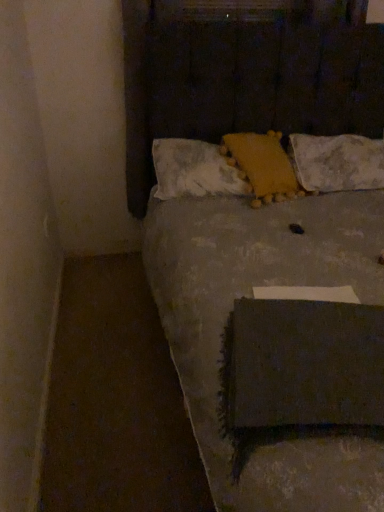
Question: Is textured gray bed at center completely or partially outside of yellow fuzzy pillow at center, which is counted as the 2th pillow, starting from the left?

Choices:
 (A) no
 (B) yes

Answer: (B)

Question: Would you consider textured gray bed at center to be distant from yellow fuzzy pillow at center, which is counted as the 2th pillow, starting from the left?

Choices:
 (A) no
 (B) yes

Answer: (A)

Question: Is textured gray bed at center next to yellow fuzzy pillow at center, which is counted as the 2th pillow, starting from the left, and touching it?

Choices:
 (A) yes
 (B) no

Answer: (B)

Question: Considering the relative positions of textured gray bed at center and yellow fuzzy pillow at center, which is the second pillow in right-to-left order, in the image provided, is textured gray bed at center to the left of yellow fuzzy pillow at center, which is the second pillow in right-to-left order, from the viewer's perspective?

Choices:
 (A) no
 (B) yes

Answer: (A)

Question: Does textured gray bed at center have a lesser height compared to yellow fuzzy pillow at center, which is counted as the 2th pillow, starting from the left?

Choices:
 (A) yes
 (B) no

Answer: (B)

Question: In the image, is textured gray bed at center positioned in front of or behind yellow textured pillow at center, which ranks as the first pillow in left-to-right order?

Choices:
 (A) front
 (B) behind

Answer: (A)

Question: Visually, is textured gray bed at center positioned to the left or to the right of yellow textured pillow at center, which ranks as the first pillow in left-to-right order?

Choices:
 (A) left
 (B) right

Answer: (B)

Question: Is textured gray bed at center wider or thinner than yellow textured pillow at center, the third pillow when ordered from right to left?

Choices:
 (A) thin
 (B) wide

Answer: (B)

Question: From a real-world perspective, relative to yellow textured pillow at center, the third pillow when ordered from right to left, is textured gray bed at center vertically above or below?

Choices:
 (A) below
 (B) above

Answer: (A)

Question: In terms of width, does yellow fuzzy pillow at center, which is counted as the 2th pillow, starting from the left, look wider or thinner when compared to textured gray bed at center?

Choices:
 (A) wide
 (B) thin

Answer: (B)

Question: Is yellow fuzzy pillow at center, which is counted as the 2th pillow, starting from the left, inside or outside of textured gray bed at center?

Choices:
 (A) outside
 (B) inside

Answer: (B)

Question: From a real-world perspective, is yellow fuzzy pillow at center, which is the second pillow in right-to-left order, above or below textured gray bed at center?

Choices:
 (A) below
 (B) above

Answer: (B)

Question: In the image, is yellow fuzzy pillow at center, which is the second pillow in right-to-left order, positioned in front of or behind textured gray bed at center?

Choices:
 (A) front
 (B) behind

Answer: (B)

Question: Visually, is white textured pillow at upper center, which is counted as the 1th pillow, starting from the right, positioned to the left or to the right of yellow fuzzy pillow at center, which is the second pillow in right-to-left order?

Choices:
 (A) right
 (B) left

Answer: (A)

Question: Relative to yellow fuzzy pillow at center, which is the second pillow in right-to-left order, is white textured pillow at upper center, which is counted as the 1th pillow, starting from the right, in front or behind?

Choices:
 (A) behind
 (B) front

Answer: (A)